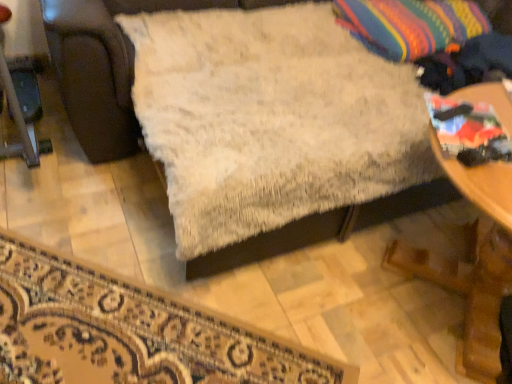
This screenshot has height=384, width=512. Describe the element at coordinates (411, 25) in the screenshot. I see `multicolored woven throw pillow at upper right` at that location.

Identify the location of multicolored woven throw pillow at upper right. (411, 25).

Identify the location of white fluffy blanket at center. (271, 119).

The width and height of the screenshot is (512, 384). In order to click on multicolored woven throw pillow at upper right in this screenshot , I will do `click(411, 25)`.

Between white fluffy blanket at center and wooden table at lower right, which one has more height?

white fluffy blanket at center is taller.

Measure the distance between white fluffy blanket at center and wooden table at lower right.

white fluffy blanket at center is 30.12 inches from wooden table at lower right.

Considering the relative sizes of white fluffy blanket at center and wooden table at lower right in the image provided, is white fluffy blanket at center bigger than wooden table at lower right?

Yes, white fluffy blanket at center is bigger than wooden table at lower right.

From a real-world perspective, is white fluffy blanket at center below wooden table at lower right?

Answer: Actually, white fluffy blanket at center is physically above wooden table at lower right in the real world.

Looking at their sizes, would you say white fluffy rug at lower center is wider or thinner than wooden table at lower right?

white fluffy rug at lower center is wider than wooden table at lower right.

From a real-world perspective, which object rests below the other?

In real-world perspective, white fluffy rug at lower center is lower.

Considering the positions of points (72, 339) and (501, 99), is point (72, 339) closer to camera compared to point (501, 99)?

Yes, point (72, 339) is in front of point (501, 99).

Are white fluffy rug at lower center and wooden table at lower right far apart?

white fluffy rug at lower center is near wooden table at lower right, not far away.

Consider the image. How many degrees apart are the facing directions of wooden table at lower right and white fluffy rug at lower center?

49.8 degrees.

Who is bigger, wooden table at lower right or white fluffy rug at lower center?

wooden table at lower right is bigger.

From a real-world perspective, does wooden table at lower right sit lower than white fluffy rug at lower center?

Actually, wooden table at lower right is physically above white fluffy rug at lower center in the real world.

Consider the image. Is wooden table at lower right to the right of white fluffy rug at lower center from the viewer's perspective?

Indeed, wooden table at lower right is positioned on the right side of white fluffy rug at lower center.

Is white fluffy rug at lower center next to white fluffy blanket at center?

No, white fluffy rug at lower center is not with white fluffy blanket at center.

Is white fluffy blanket at center at the back of white fluffy rug at lower center?

No, white fluffy rug at lower center's orientation is not away from white fluffy blanket at center.

Where is `sheet above the white fluffy rug at lower center (from a real-world perspective)`? sheet above the white fluffy rug at lower center (from a real-world perspective) is located at coordinates (271, 119).

Is multicolored woven throw pillow at upper right positioned with its back to white fluffy blanket at center?

Absolutely, multicolored woven throw pillow at upper right is directed away from white fluffy blanket at center.

From the image's perspective, which is above, multicolored woven throw pillow at upper right or white fluffy blanket at center?

From the image's view, multicolored woven throw pillow at upper right is above.

From a real-world perspective, relative to white fluffy blanket at center, is multicolored woven throw pillow at upper right vertically above or below?

From a real-world perspective, multicolored woven throw pillow at upper right is physically above white fluffy blanket at center.

Is multicolored woven throw pillow at upper right with white fluffy blanket at center?

multicolored woven throw pillow at upper right is not next to white fluffy blanket at center, and they're not touching.

Is point (210, 39) farther from camera compared to point (182, 321)?

Yes, point (210, 39) is farther from viewer.

Where is `sheet that is on the right side of white fluffy rug at lower center`? This screenshot has height=384, width=512. sheet that is on the right side of white fluffy rug at lower center is located at coordinates (271, 119).

Consider the image. From a real-world perspective, which object rests below the other?

In real-world perspective, white fluffy rug at lower center is lower.

Is white fluffy blanket at center smaller than multicolored woven throw pillow at upper right?

No.

Which is more to the right, white fluffy blanket at center or multicolored woven throw pillow at upper right?

Positioned to the right is multicolored woven throw pillow at upper right.

Which is nearer, (161, 73) or (405, 42)?

Clearly, point (161, 73) is closer to the camera than point (405, 42).

Image resolution: width=512 pixels, height=384 pixels. There is a wooden table at lower right. In order to click on sheet above it (from a real-world perspective) in this screenshot , I will do `click(271, 119)`.

Where is `table to the right of white fluffy rug at lower center`? table to the right of white fluffy rug at lower center is located at coordinates (471, 264).

Looking at this image, based on their spatial positions, is multicolored woven throw pillow at upper right or wooden table at lower right closer to white fluffy blanket at center?

multicolored woven throw pillow at upper right is closer to white fluffy blanket at center.

Consider the image. Considering their positions, is white fluffy blanket at center positioned further to white fluffy rug at lower center than wooden table at lower right?

wooden table at lower right is further to white fluffy rug at lower center.

Based on their spatial positions, is white fluffy rug at lower center or wooden table at lower right closer to white fluffy blanket at center?

white fluffy rug at lower center lies closer to white fluffy blanket at center than the other object.

Which object lies further to the anchor point multicolored woven throw pillow at upper right, white fluffy blanket at center or white fluffy rug at lower center?

white fluffy rug at lower center.

When comparing their distances from wooden table at lower right, does white fluffy blanket at center or multicolored woven throw pillow at upper right seem further?

Based on the image, multicolored woven throw pillow at upper right appears to be further to wooden table at lower right.

Based on their spatial positions, is white fluffy rug at lower center or white fluffy blanket at center closer to wooden table at lower right?

The object closer to wooden table at lower right is white fluffy blanket at center.

Estimate the real-world distances between objects in this image. Which object is further from wooden table at lower right, multicolored woven throw pillow at upper right or white fluffy blanket at center?

multicolored woven throw pillow at upper right lies further to wooden table at lower right than the other object.

From the image, which object appears to be nearer to white fluffy rug at lower center, multicolored woven throw pillow at upper right or wooden table at lower right?

wooden table at lower right is closer to white fluffy rug at lower center.

The height and width of the screenshot is (384, 512). In order to click on sheet between white fluffy rug at lower center and wooden table at lower right from left to right in this screenshot , I will do `click(271, 119)`.

The height and width of the screenshot is (384, 512). I want to click on sheet that lies between multicolored woven throw pillow at upper right and white fluffy rug at lower center from top to bottom, so click(271, 119).

Locate an element on the screen. The height and width of the screenshot is (384, 512). table between white fluffy blanket at center and multicolored woven throw pillow at upper right in the front-back direction is located at coordinates (471, 264).

Identify the location of throw pillow between white fluffy rug at lower center and wooden table at lower right in the horizontal direction. This screenshot has height=384, width=512. (411, 25).